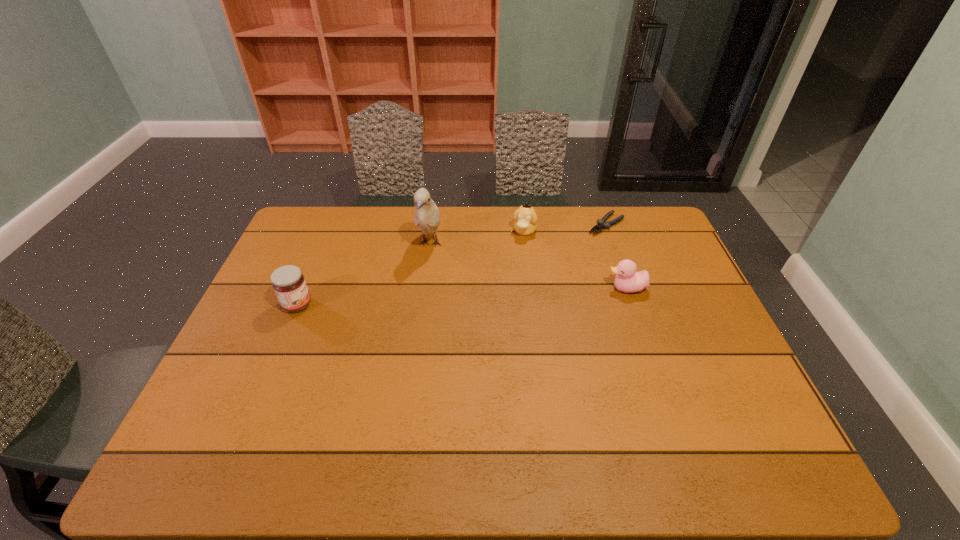
In the image, there is a desktop. Where is `free space at the left edge`? This screenshot has width=960, height=540. free space at the left edge is located at coordinates (241, 340).

You are a GUI agent. You are given a task and a screenshot of the screen. Output one action in this format:
    pyautogui.click(x=<x>, y=<y>)
    Task: Click on the vacant space at the right edge of the desktop
    
    Given the screenshot: What is the action you would take?
    pyautogui.click(x=651, y=256)

You are a GUI agent. You are given a task and a screenshot of the screen. Output one action in this format:
    pyautogui.click(x=<x>, y=<y>)
    Task: Click on the free region at the far left corner
    The height and width of the screenshot is (540, 960).
    Given the screenshot: What is the action you would take?
    pyautogui.click(x=333, y=206)

Find the location of a particular element. The image size is (960, 540). vacant space in between the shorter duckling and the pliers is located at coordinates (616, 256).

Locate an element on the screen. This screenshot has width=960, height=540. free space between the shortest object and the left duckling is located at coordinates (565, 228).

Where is `vacant area that lies between the tallest object and the leftmost object`? vacant area that lies between the tallest object and the leftmost object is located at coordinates (364, 274).

At what (x,y) coordinates should I click in order to perform the action: click on free space between the farther duckling and the pliers. Please return your answer as a coordinate pair (x, y). The image size is (960, 540). Looking at the image, I should click on (565, 228).

The width and height of the screenshot is (960, 540). In order to click on vacant space that's between the fourth object from right to left and the shorter duckling in this screenshot , I will do `click(528, 266)`.

Identify the location of vacant space that's between the shortest object and the farther duckling. This screenshot has width=960, height=540. (565, 228).

The image size is (960, 540). What are the coordinates of `free area in between the shorter duckling and the leftmost object` in the screenshot? It's located at 462,296.